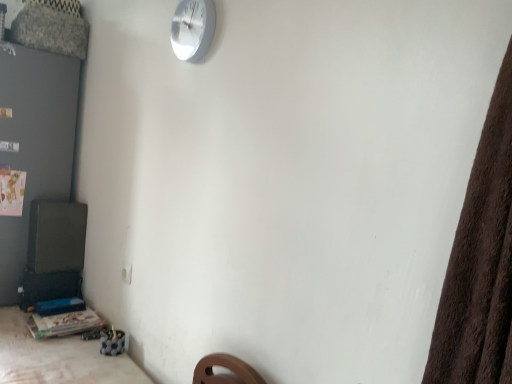
Describe the element at coordinates (64, 323) in the screenshot. I see `wooden table at lower left` at that location.

What are the coordinates of `white metallic wall clock at upper center` in the screenshot? It's located at (193, 29).

I want to click on wooden table at lower left, so click(57, 357).

Considering the sizes of objects wooden table at lower left and white metallic wall clock at upper center in the image provided, who is shorter, wooden table at lower left or white metallic wall clock at upper center?

wooden table at lower left is shorter.

How different are the orientations of wooden table at lower left and white metallic wall clock at upper center in degrees?

wooden table at lower left and white metallic wall clock at upper center are facing 0.000679 degrees away from each other.

Does wooden table at lower left have a greater width compared to white metallic wall clock at upper center?

Indeed, wooden table at lower left has a greater width compared to white metallic wall clock at upper center.

Is wooden table at lower left positioned before white metallic wall clock at upper center?

That is False.

Based on their positions, is white metallic wall clock at upper center located to the left or right of wooden table at lower left?

In the image, white metallic wall clock at upper center appears on the right side of wooden table at lower left.

From a real-world perspective, is white metallic wall clock at upper center beneath wooden table at lower left?

No, from a real-world perspective, white metallic wall clock at upper center is not beneath wooden table at lower left.

Is white metallic wall clock at upper center shorter than wooden table at lower left?

No.

Based on the photo, from the image's perspective, would you say white metallic wall clock at upper center is shown under wooden table at lower left?

Incorrect, from the image's perspective, white metallic wall clock at upper center is higher than wooden table at lower left.

Looking at this image, which object is closer to the camera taking this photo, white metallic wall clock at upper center or wooden table at lower left?

Positioned in front is wooden table at lower left.

From the image's perspective, which one is positioned higher, white metallic wall clock at upper center or wooden table at lower left?

white metallic wall clock at upper center appears higher in the image.

Is white metallic wall clock at upper center to the left of wooden table at lower left from the viewer's perspective?

No, white metallic wall clock at upper center is not to the left of wooden table at lower left.

From a real-world perspective, is wooden table at lower left beneath wooden table at lower left?

Indeed, from a real-world perspective, wooden table at lower left is positioned beneath wooden table at lower left.

Identify the location of furniture in front of the wooden table at lower left. The height and width of the screenshot is (384, 512). (57, 357).

Is wooden table at lower left at the right side of wooden table at lower left?

Indeed, wooden table at lower left is positioned on the right side of wooden table at lower left.

Is wooden table at lower left aimed at wooden table at lower left?

No, wooden table at lower left is not facing towards wooden table at lower left.

Is the position of wooden table at lower left more distant than that of white metallic wall clock at upper center?

No, it is in front of white metallic wall clock at upper center.

Is wooden table at lower left aimed at white metallic wall clock at upper center?

No, wooden table at lower left is not oriented towards white metallic wall clock at upper center.

Which of these two, wooden table at lower left or white metallic wall clock at upper center, is smaller?

Smaller between the two is white metallic wall clock at upper center.

Which is more to the right, wooden table at lower left or white metallic wall clock at upper center?

Positioned to the right is white metallic wall clock at upper center.

Do you think wooden table at lower left is within wooden table at lower left, or outside of it?

wooden table at lower left exists outside the volume of wooden table at lower left.

From the image's perspective, which one is positioned higher, wooden table at lower left or wooden table at lower left?

wooden table at lower left is shown above in the image.

In the image, is wooden table at lower left positioned in front of or behind wooden table at lower left?

wooden table at lower left is positioned farther from the viewer than wooden table at lower left.

Identify the location of table on the left of white metallic wall clock at upper center. The image size is (512, 384). (64, 323).

This screenshot has height=384, width=512. In order to click on table behind the white metallic wall clock at upper center in this screenshot , I will do `click(64, 323)`.

Looking at the image, which one is located closer to wooden table at lower left, wooden table at lower left or white metallic wall clock at upper center?

wooden table at lower left is positioned closer to the anchor wooden table at lower left.

Based on their spatial positions, is wooden table at lower left or white metallic wall clock at upper center further from wooden table at lower left?

white metallic wall clock at upper center is further to wooden table at lower left.

Which object lies nearer to the anchor point white metallic wall clock at upper center, wooden table at lower left or wooden table at lower left?

wooden table at lower left lies closer to white metallic wall clock at upper center than the other object.

Looking at the image, which one is located closer to wooden table at lower left, white metallic wall clock at upper center or wooden table at lower left?

Among the two, wooden table at lower left is located nearer to wooden table at lower left.

Considering their positions, is wooden table at lower left positioned further to white metallic wall clock at upper center than wooden table at lower left?

Among the two, wooden table at lower left is located further to white metallic wall clock at upper center.

Which object lies further to the anchor point wooden table at lower left, white metallic wall clock at upper center or wooden table at lower left?

white metallic wall clock at upper center is further to wooden table at lower left.

Image resolution: width=512 pixels, height=384 pixels. In order to click on table between white metallic wall clock at upper center and wooden table at lower left from top to bottom in this screenshot , I will do `click(64, 323)`.